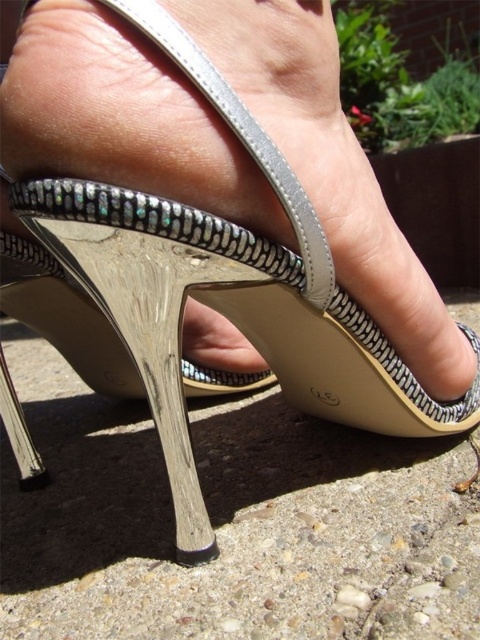
Question: Which point is farther to the camera?

Choices:
 (A) smooth concrete at center
 (B) metallic leather sandal at center

Answer: (A)

Question: Is smooth concrete at center closer to camera compared to metallic leather sandal at center?

Choices:
 (A) no
 (B) yes

Answer: (A)

Question: Can you confirm if smooth concrete at center is positioned above metallic leather sandal at center?

Choices:
 (A) yes
 (B) no

Answer: (B)

Question: Does smooth concrete at center appear over metallic leather sandal at center?

Choices:
 (A) no
 (B) yes

Answer: (A)